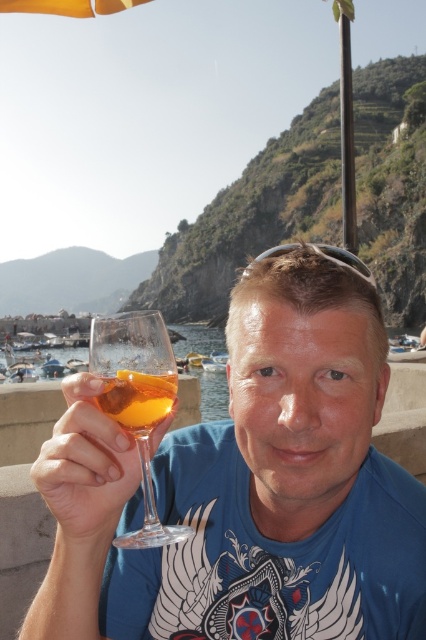
You are at a beach bar and want to know if the transparent glass at center can hold more liquid than the translucent amber liquid at center. Based on the scene, what can you conclude?

The transparent glass at center has a larger size compared to the translucent amber liquid at center, so it can hold more liquid.

You are a bartender preparing a drink for a customer who wants an Aperol Spritz. The customer mentions they prefer their drinks to be served in a glass that is proportionally larger than the liquid volume. Based on the image provided, does the clear glass wine glass at center and the translucent amber liquid at center meet this requirement?

The clear glass wine glass at center is larger in size than the translucent amber liquid at center, so it meets the customer preference for a glass that is proportionally larger than the liquid volume.

You are a photographer trying to capture the clear glass wine glass at center in your shot. The camera is positioned at point 0.0, 0.0. The glass is located at point 0.762, 0.580. What direction should you move the camera to get the glass centered in your view?

To center the clear glass wine glass at center in your view, move the camera towards the positive X and Y directions since the glass is located at point (247,486) relative to the camera at (0,0).